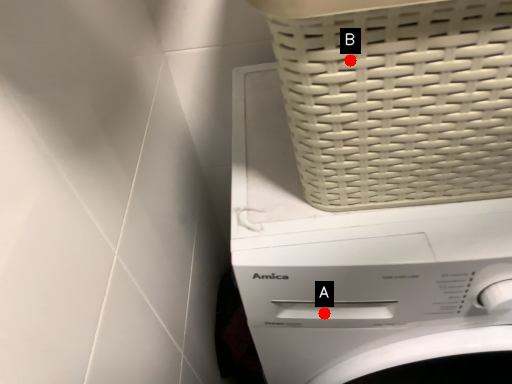
Question: Two points are circled on the image, labeled by A and B beside each circle. Among these points, which one is farthest from the camera?

Choices:
 (A) A is further
 (B) B is further

Answer: (A)